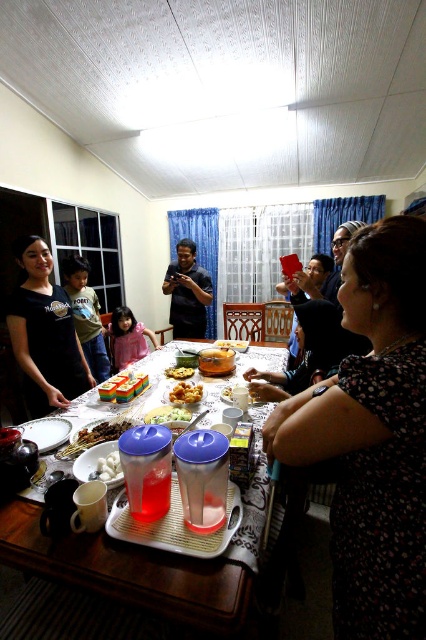
You are a photographer standing at the center of the dining room. You want to take a photo that includes both the point at coordinates point (42, 436) and point (173, 419). Which point should you focus on to ensure both are in sharp focus?

You should focus on point (42, 436) because it is closer to the camera than point (173, 419). Focusing on the closer point ensures that both will be in focus due to the depth of field.

You are standing at the dining table and want to reach both the point at coordinates (221,580) and the point at coordinates (48,324). Which point will you reach first?

You will reach the point at coordinates (221,580) first because it is closer to you than the point at coordinates (48,324).

You are at a family gathering and want to grab a snack from the dining table. You see the white glossy platter at center and the green leafy salad at center. Which one is positioned to the left?

The white glossy platter at center is positioned to the left of the green leafy salad at center.